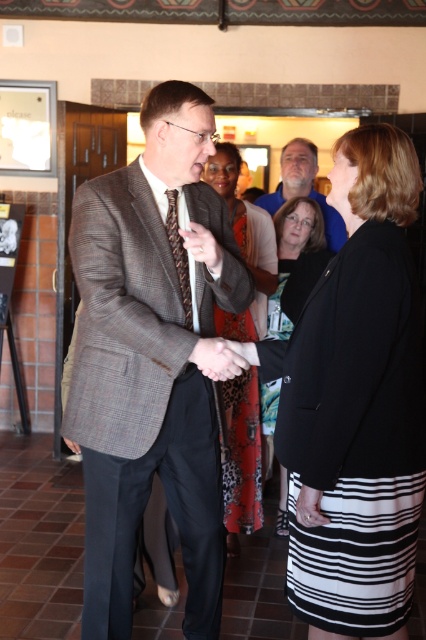
You are a photographer at a formal event. You need to capture a photo of the plaid wool suit at center and the smooth skin handshake at center. Which object should you focus on first if you want to ensure both are in frame without moving the camera?

The plaid wool suit at center is wider than the smooth skin handshake at center, so you should focus on the plaid wool suit at center first to ensure it fits within the frame before adjusting for the smaller handshake.

Consider the image. You are a photographer at a formal event and need to adjust the lighting to ensure both the black satin blazer at center and the black satin dress at center are visible. Since they are both black, how can you tell which one is closer to the camera?

The black satin blazer at center is in front of the black satin dress at center, so the blazer will appear closer to the camera and the dress will be slightly behind it.